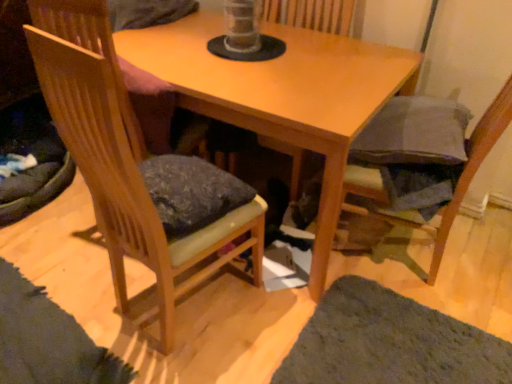
Locate an element on the screen. The width and height of the screenshot is (512, 384). vacant space to the right of wooden chair at left, which appears as the 2th chair when viewed from the right is located at coordinates (267, 323).